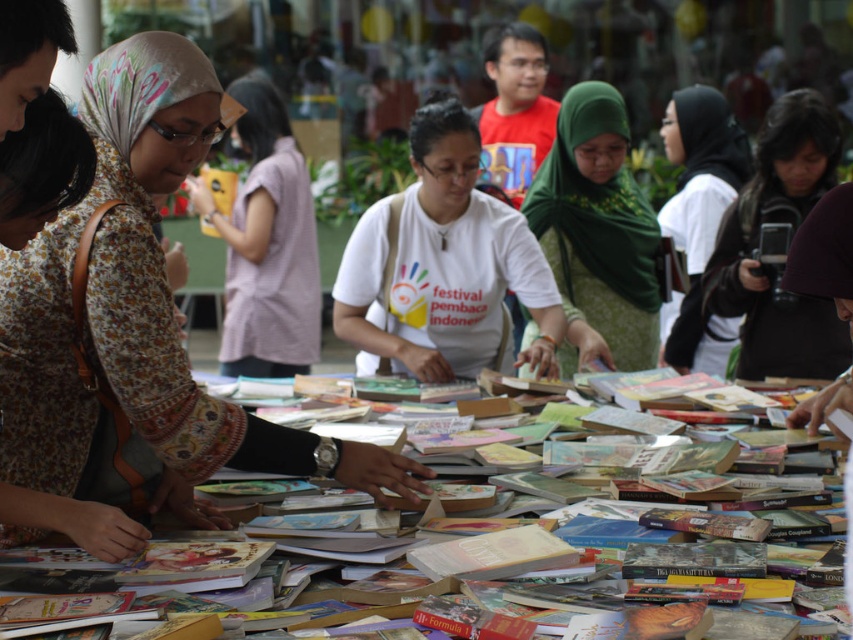
Question: Considering the relative positions of dark green fabric hijab at center and paper-covered books at center in the image provided, where is dark green fabric hijab at center located with respect to paper-covered books at center?

Choices:
 (A) left
 (B) right

Answer: (B)

Question: Among these objects, which one is farthest from the camera?

Choices:
 (A) light purple fabric shirt at center
 (B) white cotton shirt at center

Answer: (A)

Question: Considering the relative positions of matte floral dress at center and white cotton shirt at center in the image provided, where is matte floral dress at center located with respect to white cotton shirt at center?

Choices:
 (A) below
 (B) above

Answer: (A)

Question: Which point is closer to the camera taking this photo?

Choices:
 (A) (257, 312)
 (B) (62, 504)

Answer: (B)

Question: Which point is farther to the camera?

Choices:
 (A) green textured hijab at center
 (B) light purple fabric shirt at center

Answer: (B)

Question: Does light purple fabric shirt at center have a greater width compared to dark green fabric hijab at center?

Choices:
 (A) no
 (B) yes

Answer: (A)